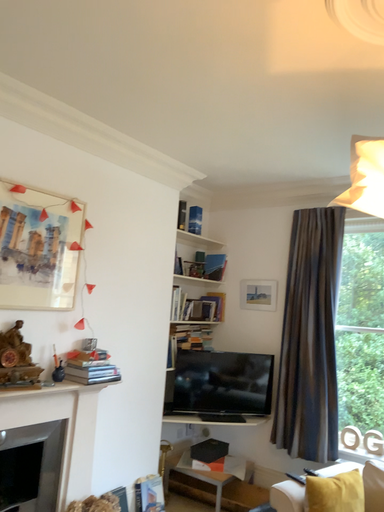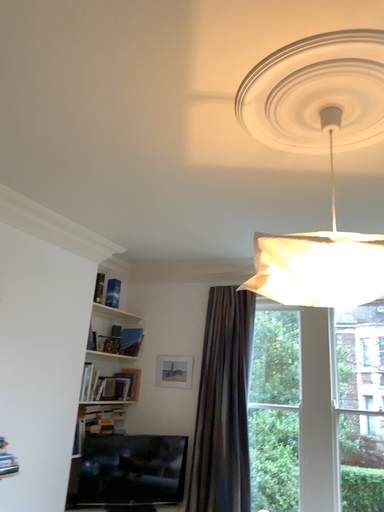
Question: How did the camera likely rotate when shooting the video?

Choices:
 (A) rotated right
 (B) rotated left

Answer: (A)